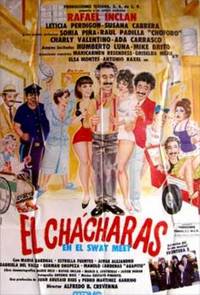
Locate an element on the screen. Image resolution: width=200 pixels, height=295 pixels. wheel chair is located at coordinates (15, 174).